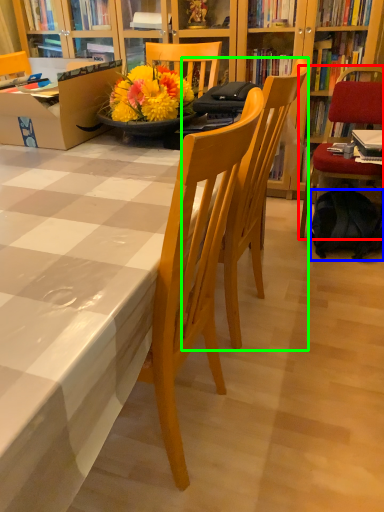
Question: Considering the real-world distances, which object is closest to chair (highlighted by a red box)? backpack (highlighted by a blue box) or chair (highlighted by a green box).

Choices:
 (A) backpack
 (B) chair

Answer: (A)